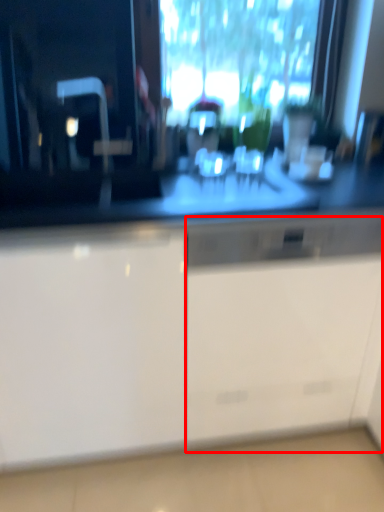
Question: From the image's perspective, considering the relative positions of file cabinet (annotated by the red box) and cabinetry in the image provided, where is file cabinet (annotated by the red box) located with respect to the staircase?

Choices:
 (A) above
 (B) below

Answer: (B)